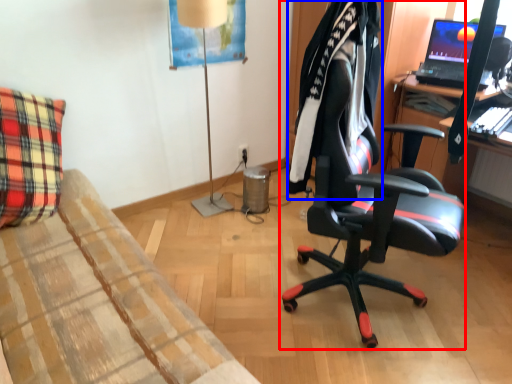
Question: Which object is closer to the camera taking this photo, chair (highlighted by a red box) or clothing (highlighted by a blue box)?

Choices:
 (A) chair
 (B) clothing

Answer: (A)